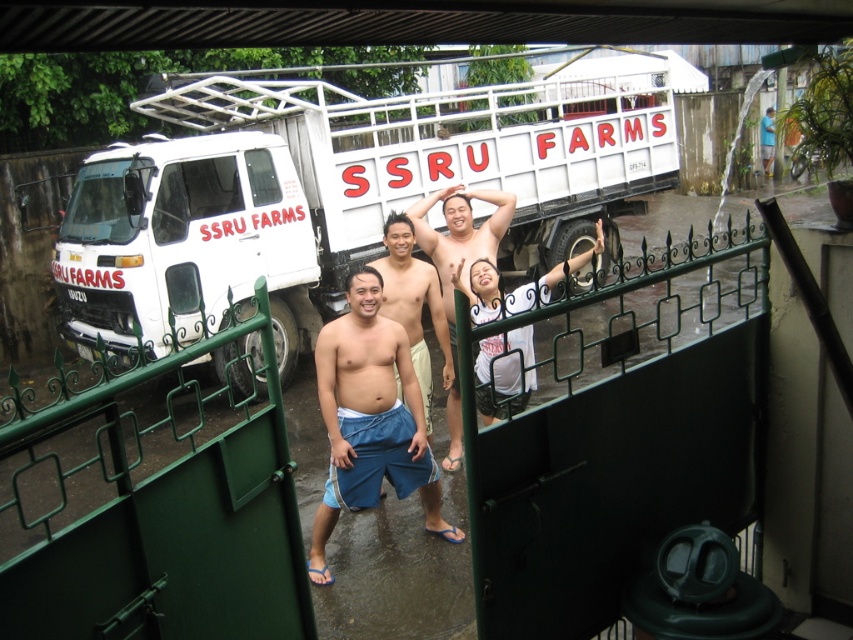
Question: Based on their relative distances, which object is farther from the blue cotton shorts at center?

Choices:
 (A) shiny metallic shirt at center
 (B) smooth skin torso at center
 (C) white cotton shirt at center

Answer: (A)

Question: Is blue cotton shorts at center positioned in front of shiny metallic shirt at center?

Choices:
 (A) yes
 (B) no

Answer: (A)

Question: Can you confirm if white cotton shirt at center is positioned to the right of shiny metallic shirt at center?

Choices:
 (A) yes
 (B) no

Answer: (A)

Question: Is blue cotton shorts at center to the left of shiny metallic shirt at center from the viewer's perspective?

Choices:
 (A) yes
 (B) no

Answer: (A)

Question: Which of the following is the closest to the observer?

Choices:
 (A) (383, 225)
 (B) (573, 120)
 (C) (483, 228)
 (D) (764, 125)

Answer: (C)

Question: Which point is farther from the camera taking this photo?

Choices:
 (A) (769, 161)
 (B) (451, 221)

Answer: (A)